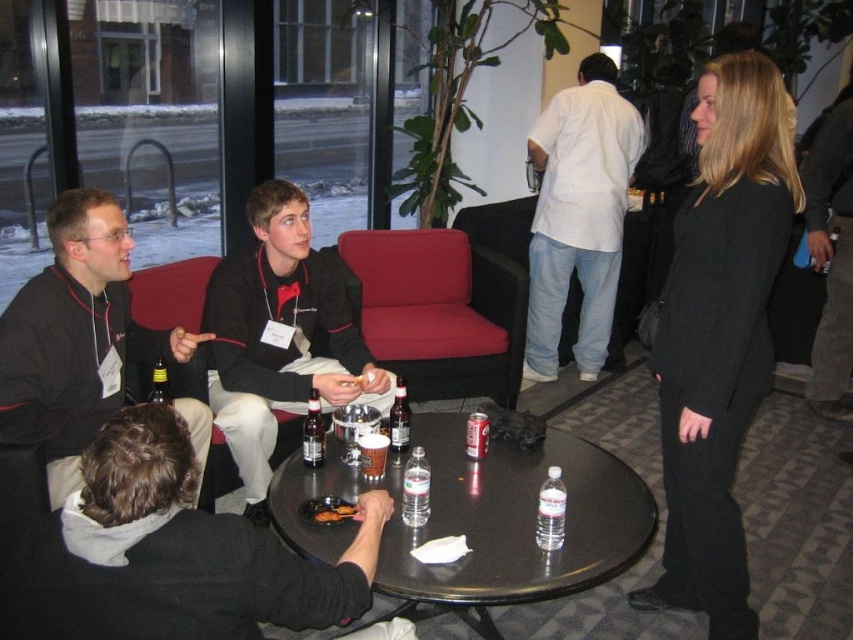
Question: Which point is closer to the camera?

Choices:
 (A) (219, 356)
 (B) (741, 122)
 (C) (583, 99)

Answer: (B)

Question: From the image, what is the correct spatial relationship of black wool suit at right in relation to white cotton shirt at center?

Choices:
 (A) below
 (B) above

Answer: (A)

Question: Which of the following is the farthest from the observer?

Choices:
 (A) matte black shirt at center
 (B) dark brown glass bottle at table center
 (C) matte black jacket at left
 (D) black plastic table at center

Answer: (A)

Question: Which of the following is the closest to the observer?

Choices:
 (A) white cotton shirt at center
 (B) black wool suit at right

Answer: (B)

Question: Is black plastic table at center thinner than dark brown glass bottle at table center?

Choices:
 (A) yes
 (B) no

Answer: (B)

Question: From the image, what is the correct spatial relationship of matte black shirt at center in relation to dark brown glass bottle at table center?

Choices:
 (A) right
 (B) left

Answer: (B)